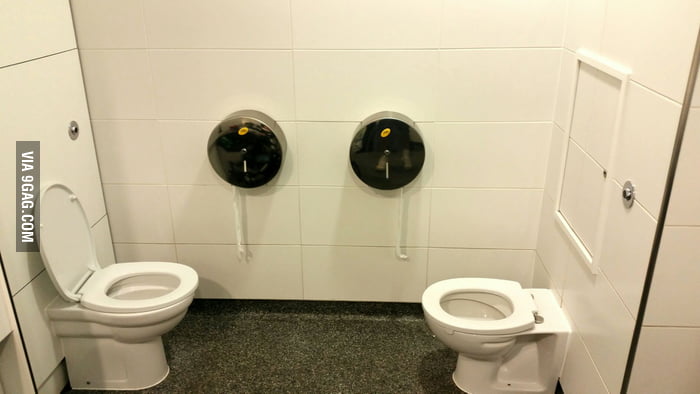
You are a GUI agent. You are given a task and a screenshot of the screen. Output one action in this format:
    pyautogui.click(x=<x>, y=<y>)
    Task: Click on the toilet paper holder
    This screenshot has width=700, height=394.
    Given the screenshot: What is the action you would take?
    pyautogui.click(x=265, y=139), pyautogui.click(x=369, y=132)